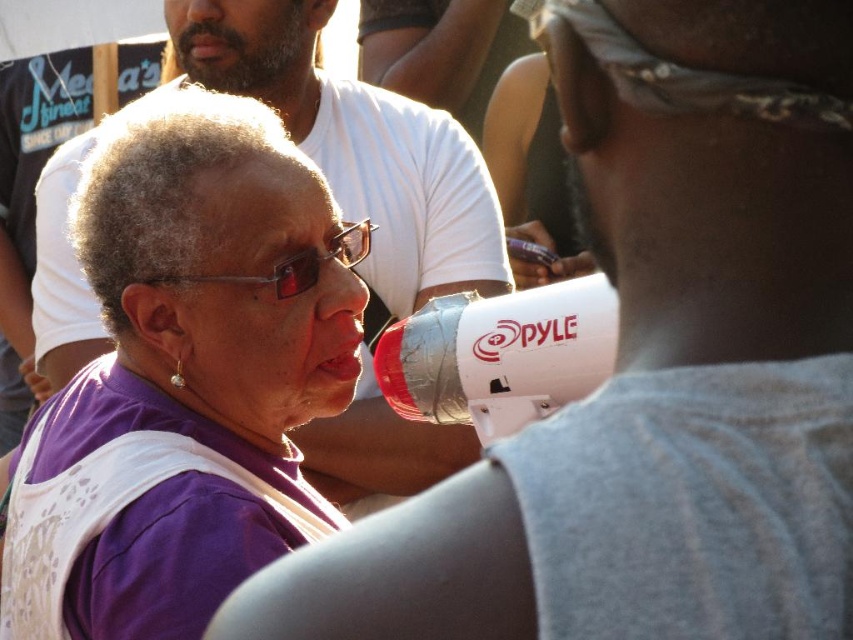
Question: Is white matte megaphone at center bigger than sunglasses at center?

Choices:
 (A) yes
 (B) no

Answer: (A)

Question: Can you confirm if white matte megaphone at center is wider than bearded man at upper left?

Choices:
 (A) no
 (B) yes

Answer: (B)

Question: Which object is the closest to the purple fabric at center?

Choices:
 (A) bearded man at upper left
 (B) sunglasses at center
 (C) white matte megaphone at center
 (D) matte purple glasses at center

Answer: (D)

Question: Which object is the closest to the bearded man at upper left?

Choices:
 (A) sunglasses at center
 (B) purple fabric at center
 (C) matte purple glasses at center
 (D) white matte megaphone at center

Answer: (D)

Question: From the image, what is the correct spatial relationship of matte purple glasses at center in relation to sunglasses at center?

Choices:
 (A) above
 (B) below

Answer: (B)

Question: Which object is the farthest from the matte purple glasses at center?

Choices:
 (A) purple fabric at center
 (B) white matte megaphone at center

Answer: (B)